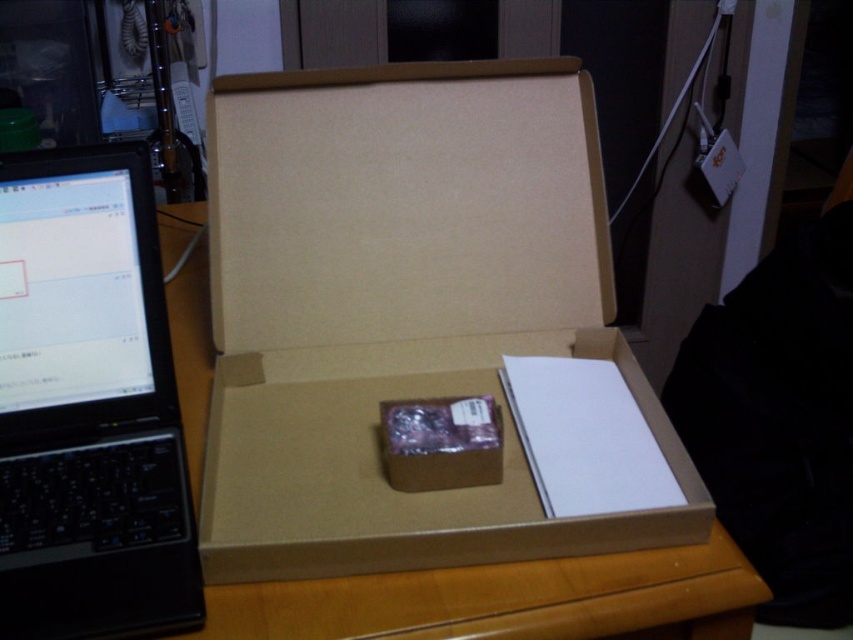
You are holding a 10 cm ruler and want to measure the distance from your eye to the point at coordinates point [157,326] in the image. Based on the information provided, what is the actual distance in centimeters between your eye and the point?

The point [157,326] is 75.18 centimeters away from the camera. Since you are holding the ruler at your eye level, the distance from your eye to the point would also be approximately 75.18 centimeters.

You are organizing a workspace and need to move the black plastic laptop at left and the wooden table at center. Which object should you move first if you want to access the other one?

You should move the black plastic laptop at left first because it is positioned under the wooden table at center, so to access the wooden table at center, you need to move the laptop out of the way first.